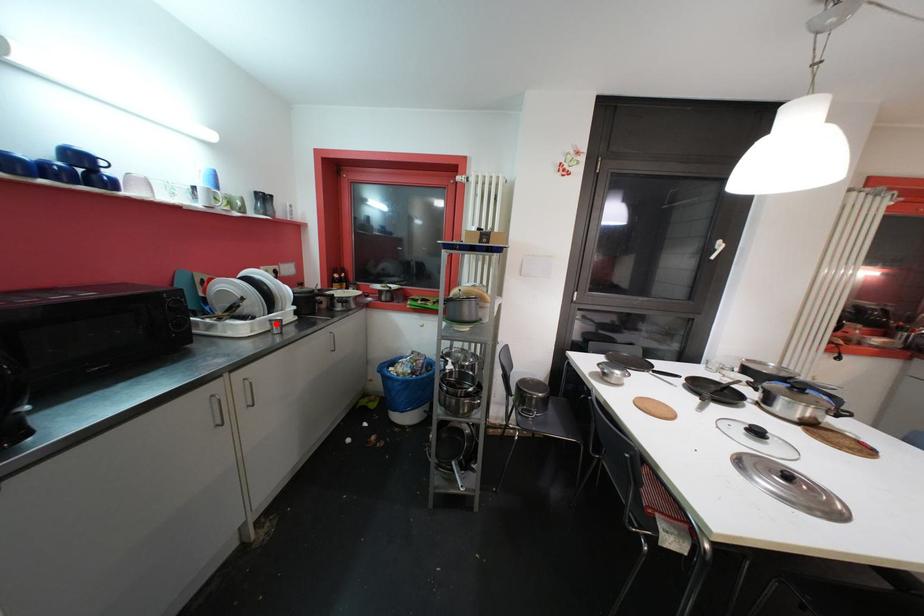
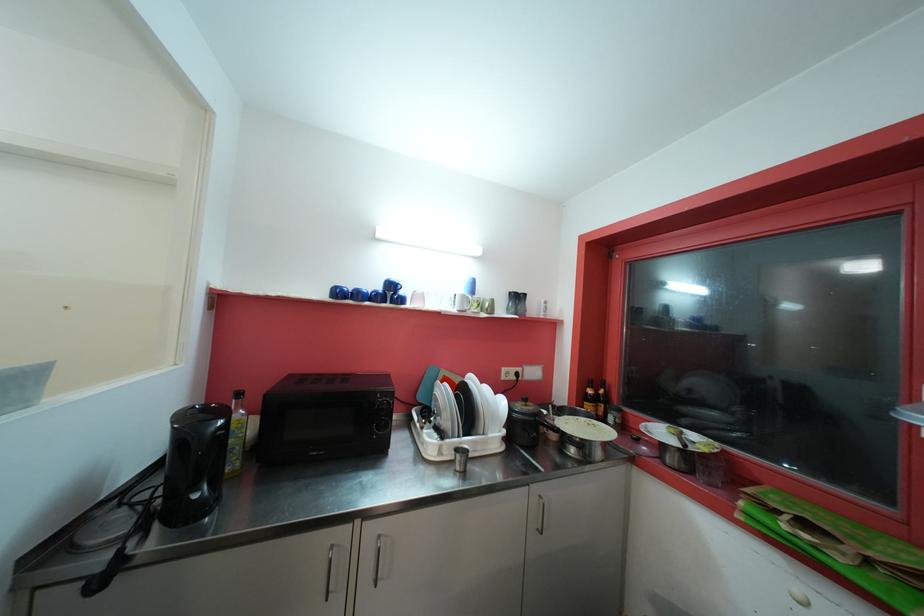
Question: I am providing you with two images of the same scene from different viewpoints. Image1 has a red point marked. In image2, the corresponding 3D location appears at what relative position? Reply with the corresponding letter.

Choices:
 (A) Closer
 (B) Farther

Answer: (B)